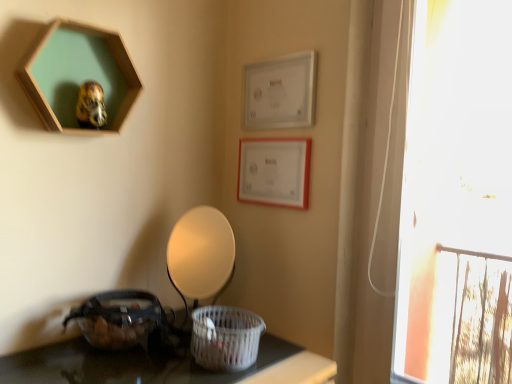
Question: Is white woven basket at lower center, which is counted as the second basket, starting from the left, positioned far away from matte white lampshade at center?

Choices:
 (A) yes
 (B) no

Answer: (B)

Question: Can you see white woven basket at lower center, which is counted as the second basket, starting from the left, touching matte white lampshade at center?

Choices:
 (A) no
 (B) yes

Answer: (A)

Question: Does white woven basket at lower center, which is the first basket in right-to-left order, have a smaller size compared to matte white lampshade at center?

Choices:
 (A) yes
 (B) no

Answer: (A)

Question: From the image's perspective, would you say white woven basket at lower center, which is counted as the second basket, starting from the left, is shown under matte white lampshade at center?

Choices:
 (A) yes
 (B) no

Answer: (A)

Question: Can you confirm if white woven basket at lower center, which is the first basket in right-to-left order, is wider than matte white lampshade at center?

Choices:
 (A) no
 (B) yes

Answer: (B)

Question: Does white woven basket at lower center, which is the first basket in right-to-left order, have a larger size compared to matte white lampshade at center?

Choices:
 (A) yes
 (B) no

Answer: (B)

Question: Could you tell me if matte white picture frame at upper right, acting as the 2th picture frame starting from the left, is turned towards white matte picture frame at upper center, which appears as the 1th picture frame when viewed from the right?

Choices:
 (A) no
 (B) yes

Answer: (A)

Question: Can you confirm if matte white picture frame at upper right, which is the 2th picture frame in right-to-left order, is bigger than white matte picture frame at upper center, which appears as the 1th picture frame when viewed from the right?

Choices:
 (A) no
 (B) yes

Answer: (A)

Question: Can you confirm if matte white picture frame at upper right, acting as the 2th picture frame starting from the left, is shorter than white matte picture frame at upper center, which appears as the 1th picture frame when viewed from the right?

Choices:
 (A) yes
 (B) no

Answer: (A)

Question: From the image's perspective, is matte white picture frame at upper right, which is the 2th picture frame in right-to-left order, beneath white matte picture frame at upper center, positioned as the third picture frame in left-to-right order?

Choices:
 (A) yes
 (B) no

Answer: (A)

Question: Is matte white picture frame at upper right, which is the 2th picture frame in right-to-left order, not close to white matte picture frame at upper center, positioned as the third picture frame in left-to-right order?

Choices:
 (A) yes
 (B) no

Answer: (B)

Question: Considering the relative sizes of matte white picture frame at upper right, which is the 2th picture frame in right-to-left order, and white matte picture frame at upper center, positioned as the third picture frame in left-to-right order, in the image provided, is matte white picture frame at upper right, which is the 2th picture frame in right-to-left order, taller than white matte picture frame at upper center, positioned as the third picture frame in left-to-right order,?

Choices:
 (A) no
 (B) yes

Answer: (A)

Question: Is translucent plastic basket at lower left, the first basket from the left, with matte white lampshade at center?

Choices:
 (A) no
 (B) yes

Answer: (A)